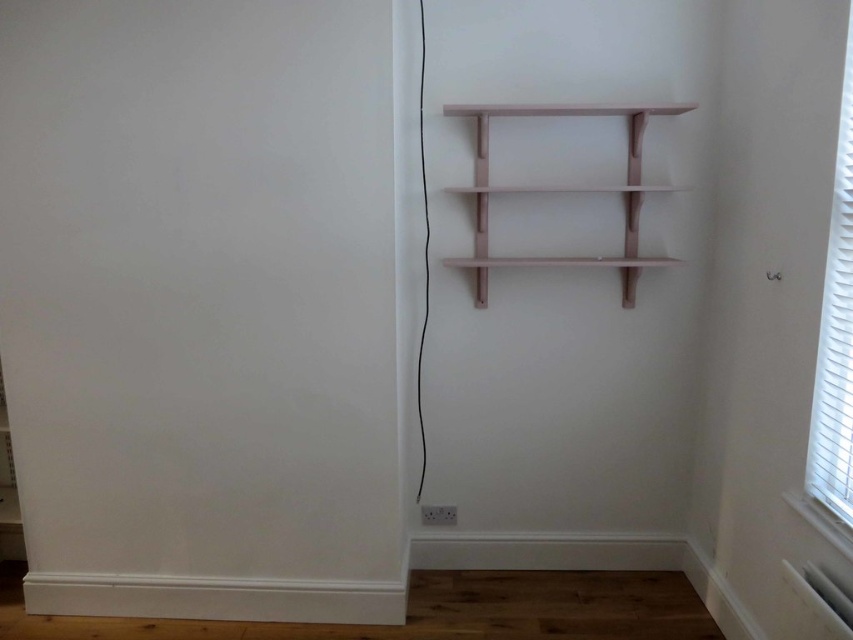
You are looking at the corner of a room with two points marked. The first point is at coordinate (811, 396) and the second is at (589, 186). Based on the scene description, which point is closer to you?

Point (811, 396) is closer to the camera than point (589, 186).

You are planning to hang a new picture frame that is 1 meter wide on the wall next to the white textured blinds at right. Considering the space available, will the matte pink shelf at upper center interfere with the placement of your frame?

The white textured blinds at right is narrower than the matte pink shelf at upper center, so the shelf might extend further horizontally. This could potentially interfere with the placement of your 1 meter wide picture frame next to the blinds. Check the exact measurements before hanging.